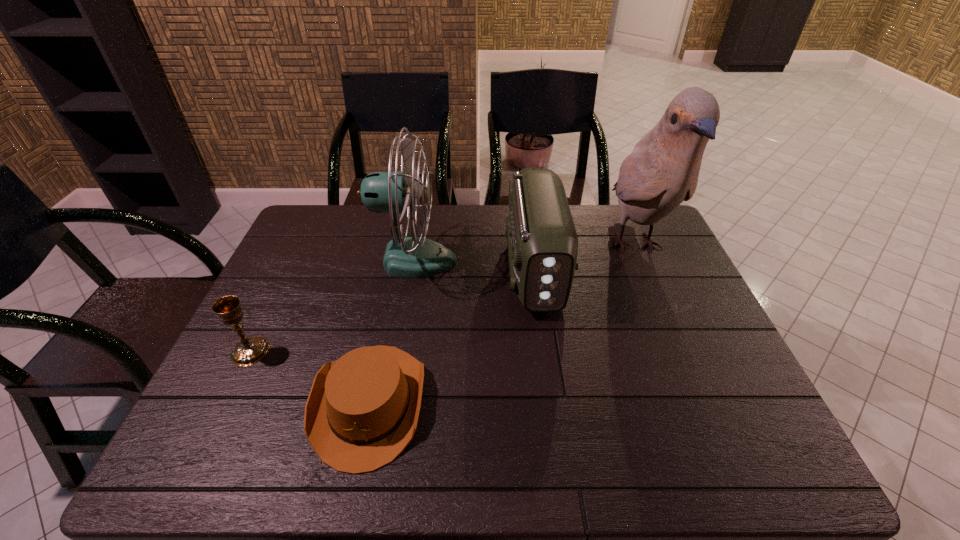
This screenshot has width=960, height=540. In order to click on vacant region between the fourth shortest object and the leftmost object in this screenshot , I will do `click(332, 306)`.

You are a GUI agent. You are given a task and a screenshot of the screen. Output one action in this format:
    pyautogui.click(x=<x>, y=<y>)
    Task: Click on the empty space between the cowboy hat and the parakeet
    This screenshot has height=540, width=960.
    Given the screenshot: What is the action you would take?
    pyautogui.click(x=502, y=325)

Where is `free spot between the leftmost object and the third tallest object`? This screenshot has height=540, width=960. free spot between the leftmost object and the third tallest object is located at coordinates (393, 310).

I want to click on unoccupied area between the chalice and the rightmost object, so click(x=443, y=299).

Select which object is the fourth closest to the tallest object. Please provide its 2D coordinates. Your answer should be formatted as a tuple, i.e. [(x, y)], where the tuple contains the x and y coordinates of a point satisfying the conditions above.

[(251, 350)]

Find the location of `the third closest object to the shortest object`. the third closest object to the shortest object is located at coordinates (542, 242).

Image resolution: width=960 pixels, height=540 pixels. I want to click on free space that satisfies the following two spatial constraints: 1. on the face of the rightmost object; 2. in front of the second tallest object, directing airflow, so click(640, 260).

This screenshot has width=960, height=540. Identify the location of free region that satisfies the following two spatial constraints: 1. in front of the fan, directing airflow; 2. on the front-facing side of the cowboy hat. (389, 402).